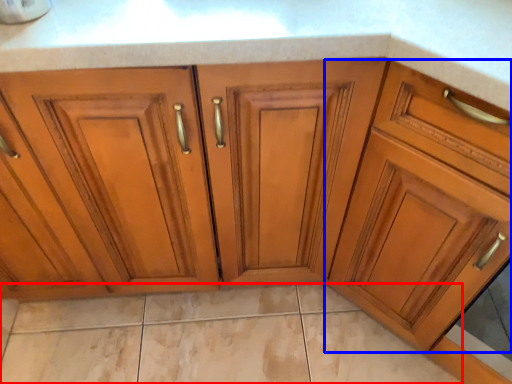
Question: Which object is closer to the camera taking this photo, granite (highlighted by a red box) or cabinetry (highlighted by a blue box)?

Choices:
 (A) granite
 (B) cabinetry

Answer: (B)